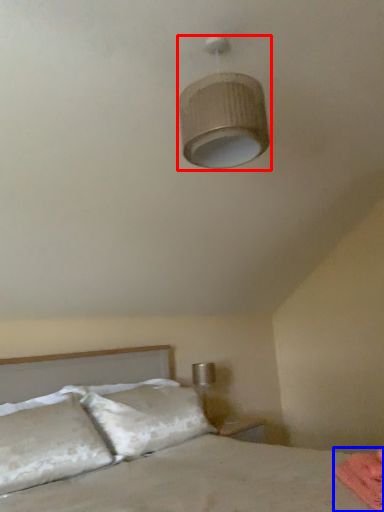
Question: Which point is closer to the camera, lamp (highlighted by a red box) or sheet (highlighted by a blue box)?

Choices:
 (A) lamp
 (B) sheet

Answer: (B)